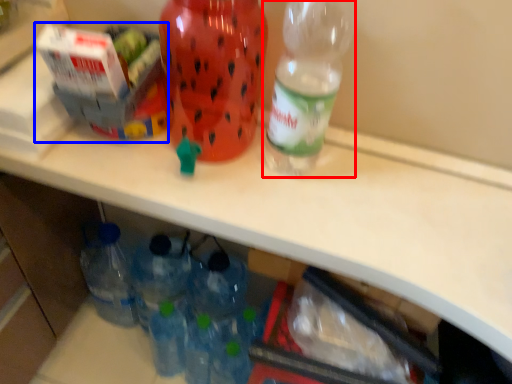
Question: Which of the following is the closest to the observer, bottle (highlighted by a red box) or box (highlighted by a blue box)?

Choices:
 (A) bottle
 (B) box

Answer: (A)